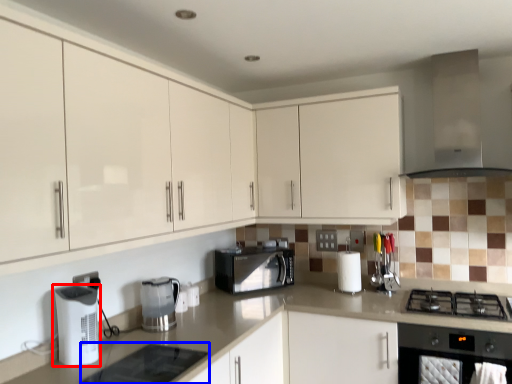
Question: Which object is closer to the camera taking this photo, kitchen appliance (highlighted by a red box) or appliance (highlighted by a blue box)?

Choices:
 (A) kitchen appliance
 (B) appliance

Answer: (B)